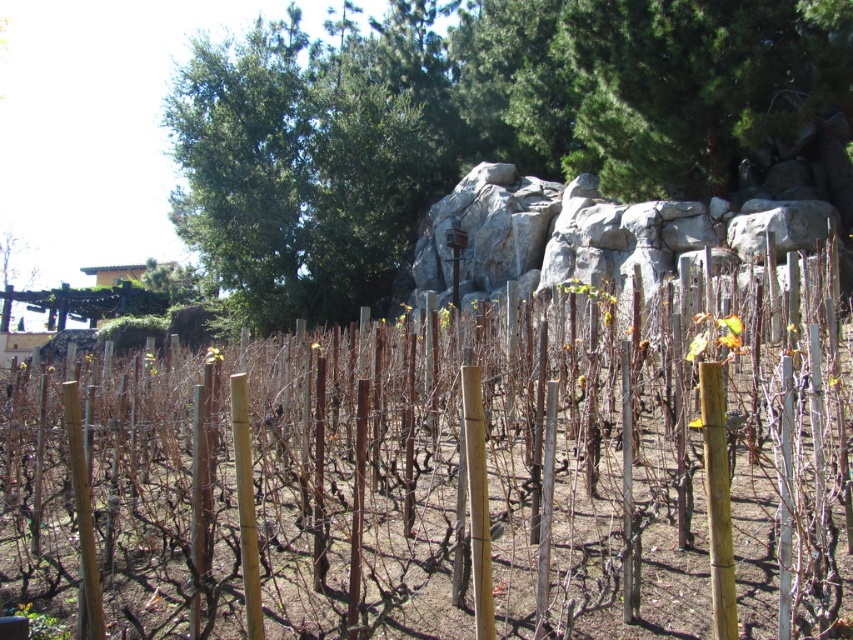
Question: Does green leafy tree at upper center appear over gray rock at center?

Choices:
 (A) no
 (B) yes

Answer: (B)

Question: Which object appears closest to the camera in this image?

Choices:
 (A) green leafy tree at upper left
 (B) gray rock at center
 (C) brown wooden post at center
 (D) green leafy tree at upper center

Answer: (C)

Question: Is brown wooden post at center above green leafy tree at upper center?

Choices:
 (A) yes
 (B) no

Answer: (B)

Question: Can you confirm if brown wooden post at center is positioned to the right of green leafy tree at upper left?

Choices:
 (A) no
 (B) yes

Answer: (B)

Question: Which object is the farthest from the gray rock at center?

Choices:
 (A) brown wooden post at center
 (B) green leafy tree at upper left
 (C) green leafy tree at upper center

Answer: (B)

Question: Which of the following is the farthest from the observer?

Choices:
 (A) green leafy tree at upper center
 (B) gray rock at center
 (C) brown wooden post at center

Answer: (B)